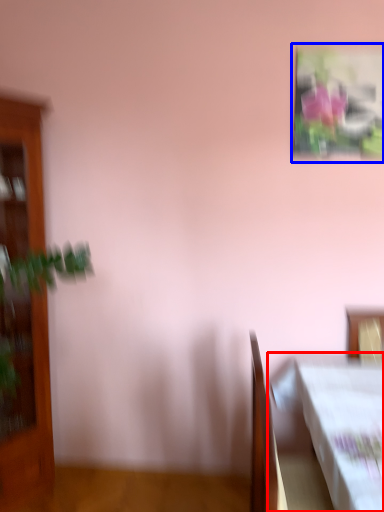
Question: Which object appears closest to the camera in this image, table (highlighted by a red box) or picture frame (highlighted by a blue box)?

Choices:
 (A) table
 (B) picture frame

Answer: (A)